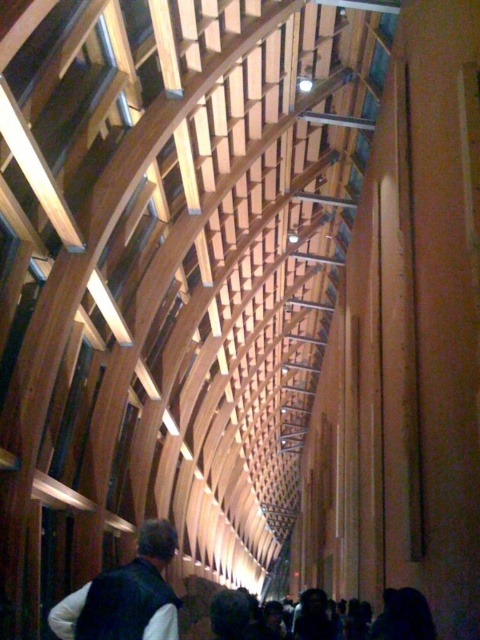
Is dark brown leather jacket at lower left to the left of dark hair at lower center from the viewer's perspective?

Correct, you'll find dark brown leather jacket at lower left to the left of dark hair at lower center.

Which of these two, dark brown leather jacket at lower left or dark hair at lower center, stands taller?

dark brown leather jacket at lower left is taller.

The height and width of the screenshot is (640, 480). I want to click on dark brown leather jacket at lower left, so (126, 595).